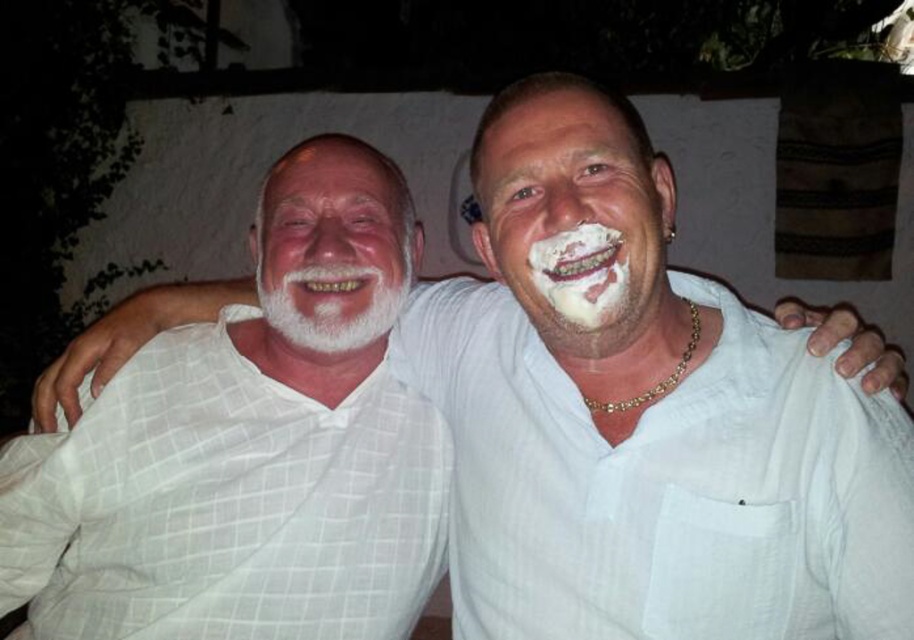
Question: Is the position of white checkered shirt at left less distant than that of white matte face at center?

Choices:
 (A) no
 (B) yes

Answer: (A)

Question: Which is nearer to the white soft beard at center?

Choices:
 (A) white matte beard at left
 (B) white creamy shaving cream at mouth

Answer: (A)

Question: Does white checkered shirt at left have a greater width compared to white matte face at center?

Choices:
 (A) no
 (B) yes

Answer: (B)

Question: Which of the following is the farthest from the observer?

Choices:
 (A) (620, 314)
 (B) (392, 186)
 (C) (482, 156)

Answer: (B)

Question: Is white matte face at center below white soft beard at center?

Choices:
 (A) no
 (B) yes

Answer: (A)

Question: Which of the following is the farthest from the observer?

Choices:
 (A) white soft beard at center
 (B) white checkered shirt at left
 (C) white creamy shaving cream at mouth
 (D) white matte face at center

Answer: (A)